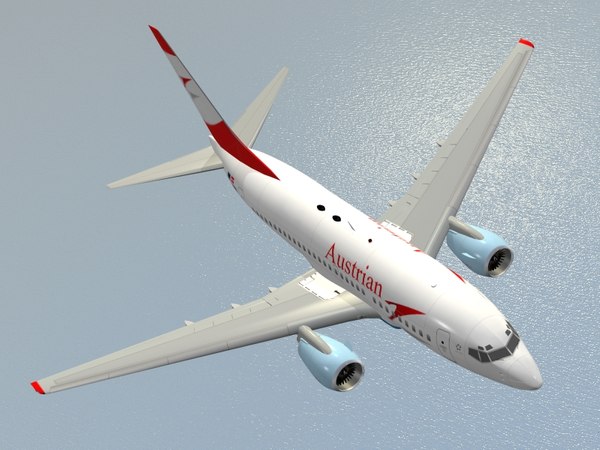
The width and height of the screenshot is (600, 450). I want to click on door, so click(445, 342).